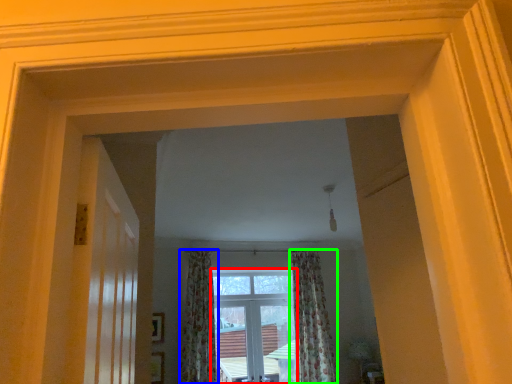
Question: Which is farther away from window (highlighted by a red box)? curtain (highlighted by a blue box) or curtain (highlighted by a green box)?

Choices:
 (A) curtain
 (B) curtain

Answer: (A)